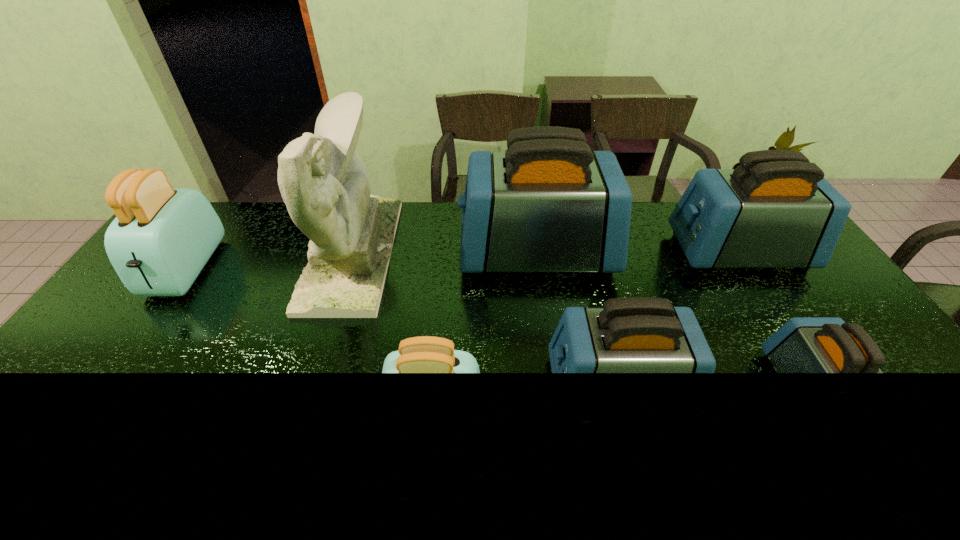
You are a GUI agent. You are given a task and a screenshot of the screen. Output one action in this format:
    pyautogui.click(x=<x>, y=<y>)
    Task: Click on the blue toaster that stands as the fourth closest to the farther light toaster
    The height and width of the screenshot is (540, 960).
    Given the screenshot: What is the action you would take?
    pyautogui.click(x=803, y=344)